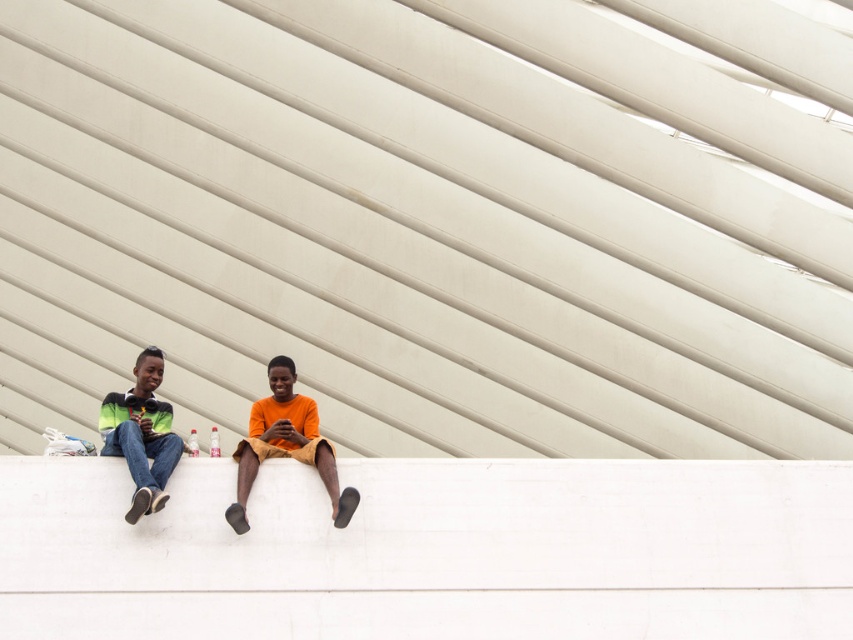
Is orange matte shirt at center positioned at the back of green-yellow striped shirt at left?

Yes.

Between point (279, 424) and point (109, 401), which one is positioned behind?

The point (109, 401) is more distant.

Who is more distant from viewer, (x=334, y=476) or (x=148, y=499)?

The point (x=334, y=476) is behind.

This screenshot has height=640, width=853. What are the coordinates of `orange matte shirt at center` in the screenshot? It's located at (286, 444).